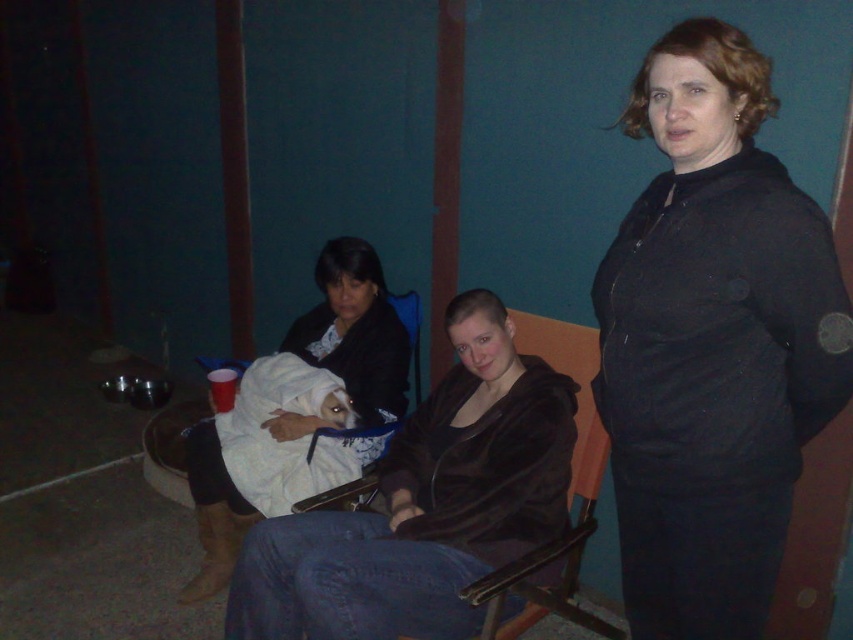
Question: Can you confirm if velvet brown jacket at center is bigger than white soft blanket at center?

Choices:
 (A) yes
 (B) no

Answer: (A)

Question: Which of the following is the closest to the observer?

Choices:
 (A) (341, 420)
 (B) (428, 596)
 (C) (357, 259)
 (D) (740, 477)

Answer: (D)

Question: Is black matte jacket at center positioned before white towel at center?

Choices:
 (A) yes
 (B) no

Answer: (A)

Question: Can you confirm if velvet brown jacket at center is positioned below white soft blanket at center?

Choices:
 (A) yes
 (B) no

Answer: (A)

Question: Estimate the real-world distances between objects in this image. Which object is farther from the velvet brown jacket at center?

Choices:
 (A) black matte jacket at center
 (B) white towel at center

Answer: (A)

Question: Which object is closer to the camera taking this photo?

Choices:
 (A) velvet brown jacket at center
 (B) black matte jacket at center
 (C) white soft blanket at center

Answer: (B)